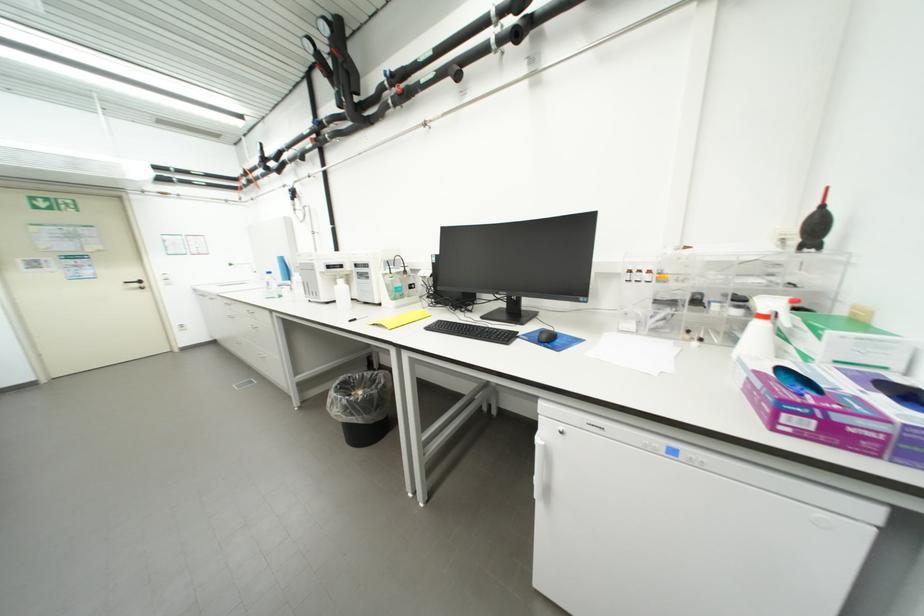
Find where to turn the black door handle. Please return your answer as a coordinate pair (x, y).

(136, 283)